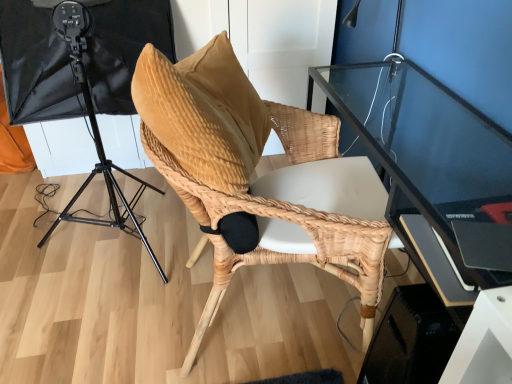
At what (x,y) coordinates should I click in order to perform the action: click on natural woven chair at center. Please return your answer as a coordinate pair (x, y). The height and width of the screenshot is (384, 512). Looking at the image, I should click on (247, 174).

Describe the element at coordinates (247, 174) in the screenshot. I see `natural woven chair at center` at that location.

Where is `black matte tripod at left`? black matte tripod at left is located at coordinates coord(94,128).

Measure the distance between point (123, 224) and camera.

A distance of 1.68 meters exists between point (123, 224) and camera.

What do you see at coordinates (94, 128) in the screenshot? The image size is (512, 384). I see `black matte tripod at left` at bounding box center [94, 128].

I want to click on natural woven chair at center, so click(247, 174).

Which object is positioned more to the right, natural woven chair at center or black matte tripod at left?

Positioned to the right is natural woven chair at center.

Is natural woven chair at center further to camera compared to black matte tripod at left?

No, it is not.

Which is in front, point (215, 248) or point (62, 215)?

The point (215, 248) is closer.

From the image's perspective, which is below, natural woven chair at center or black matte tripod at left?

natural woven chair at center.

From a real-world perspective, between natural woven chair at center and black matte tripod at left, who is vertically lower?

From a 3D spatial view, natural woven chair at center is below.

Which object is thinner, natural woven chair at center or black matte tripod at left?

natural woven chair at center is thinner.

Between natural woven chair at center and black matte tripod at left, which one has less height?

natural woven chair at center is shorter.

Can you confirm if natural woven chair at center is smaller than black matte tripod at left?

Indeed, natural woven chair at center has a smaller size compared to black matte tripod at left.

Is natural woven chair at center situated inside black matte tripod at left or outside?

natural woven chair at center is not enclosed by black matte tripod at left.

Is natural woven chair at center not near black matte tripod at left?

No, natural woven chair at center is in close proximity to black matte tripod at left.

Is natural woven chair at center positioned with its back to black matte tripod at left?

Absolutely, natural woven chair at center is directed away from black matte tripod at left.

How many degrees apart are the facing directions of natural woven chair at center and black matte tripod at left?

natural woven chair at center and black matte tripod at left are facing 77.9 degrees away from each other.

I want to click on tripod located above the natural woven chair at center (from a real-world perspective), so click(x=94, y=128).

Does black matte tripod at left appear on the right side of natural woven chair at center?

No, black matte tripod at left is not to the right of natural woven chair at center.

Does black matte tripod at left come in front of natural woven chair at center?

No, black matte tripod at left is further to the viewer.

Is point (72, 3) closer to camera compared to point (237, 232)?

No, (72, 3) is behind (237, 232).

From the picture: From the image's perspective, is black matte tripod at left located beneath natural woven chair at center?

No, from the image's perspective, black matte tripod at left is not beneath natural woven chair at center.

From a real-world perspective, is black matte tripod at left over natural woven chair at center?

Yes, from a real-world perspective, black matte tripod at left is over natural woven chair at center

Does black matte tripod at left have a greater width compared to natural woven chair at center?

Correct, the width of black matte tripod at left exceeds that of natural woven chair at center.

Between black matte tripod at left and natural woven chair at center, which one has more height?

With more height is black matte tripod at left.

Considering the relative sizes of black matte tripod at left and natural woven chair at center in the image provided, is black matte tripod at left bigger than natural woven chair at center?

Indeed, black matte tripod at left has a larger size compared to natural woven chair at center.

Could natural woven chair at center be considered to be inside black matte tripod at left?

No, natural woven chair at center is not a part of black matte tripod at left.

Is black matte tripod at left positioned far away from natural woven chair at center?

No.

Is black matte tripod at left oriented towards natural woven chair at center?

No, black matte tripod at left is not turned towards natural woven chair at center.

How different are the orientations of black matte tripod at left and natural woven chair at center in degrees?

The angular difference between black matte tripod at left and natural woven chair at center is 77.9 degrees.

The height and width of the screenshot is (384, 512). I want to click on tripod positioned vertically above the natural woven chair at center (from a real-world perspective), so click(x=94, y=128).

Find the location of a particular element. The width and height of the screenshot is (512, 384). chair below the black matte tripod at left (from the image's perspective) is located at coordinates (247, 174).

Identify the location of tripod above the natural woven chair at center (from the image's perspective). This screenshot has width=512, height=384. [94, 128].